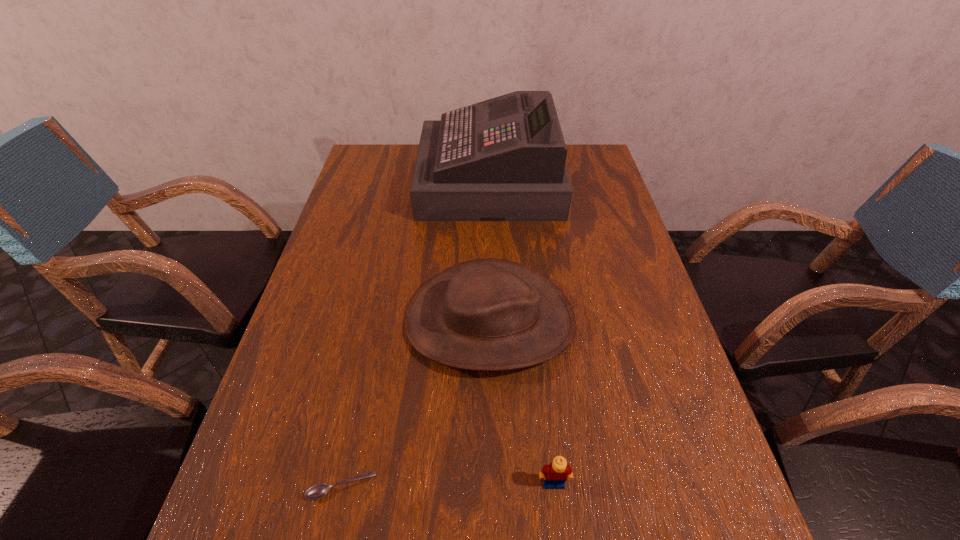
Identify the location of the tallest object. This screenshot has width=960, height=540. (503, 159).

The image size is (960, 540). I want to click on cash register, so click(x=503, y=159).

The image size is (960, 540). I want to click on the second tallest object, so click(488, 314).

Locate an element on the screen. The width and height of the screenshot is (960, 540). cowboy hat is located at coordinates (488, 314).

At what (x,y) coordinates should I click in order to perform the action: click on Lego. Please return your answer as a coordinate pair (x, y). Looking at the image, I should click on (558, 471).

I want to click on the shortest object, so click(x=317, y=491).

Image resolution: width=960 pixels, height=540 pixels. Find the location of `free space located on the front-facing side of the cash register`. free space located on the front-facing side of the cash register is located at coordinates (399, 181).

Where is `free space located 0.140m on the front-facing side of the cash register`? free space located 0.140m on the front-facing side of the cash register is located at coordinates (378, 181).

Find the location of `vacant space located 0.050m on the front-facing side of the cash register`. vacant space located 0.050m on the front-facing side of the cash register is located at coordinates (405, 181).

Identify the location of free location located on the back of the third shortest object. (488, 197).